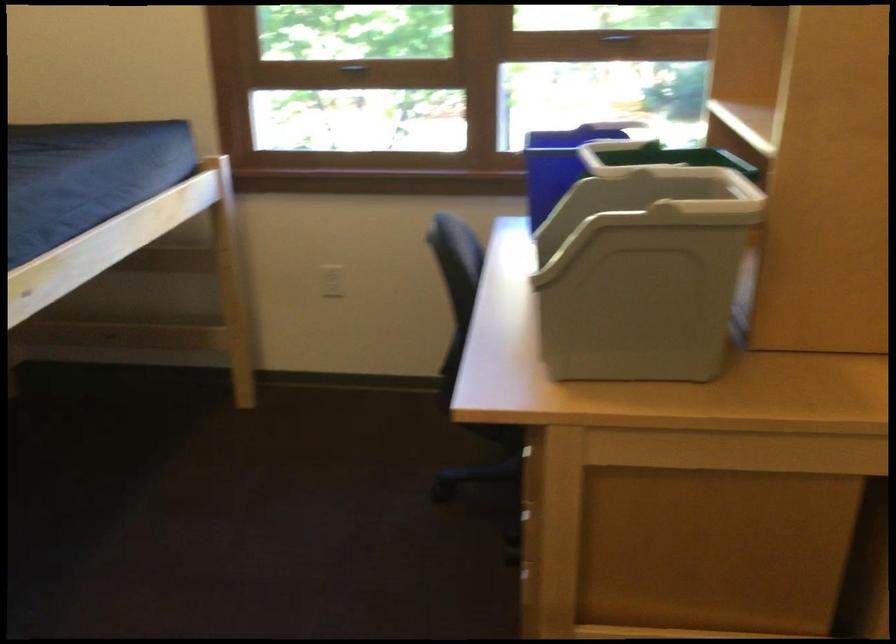
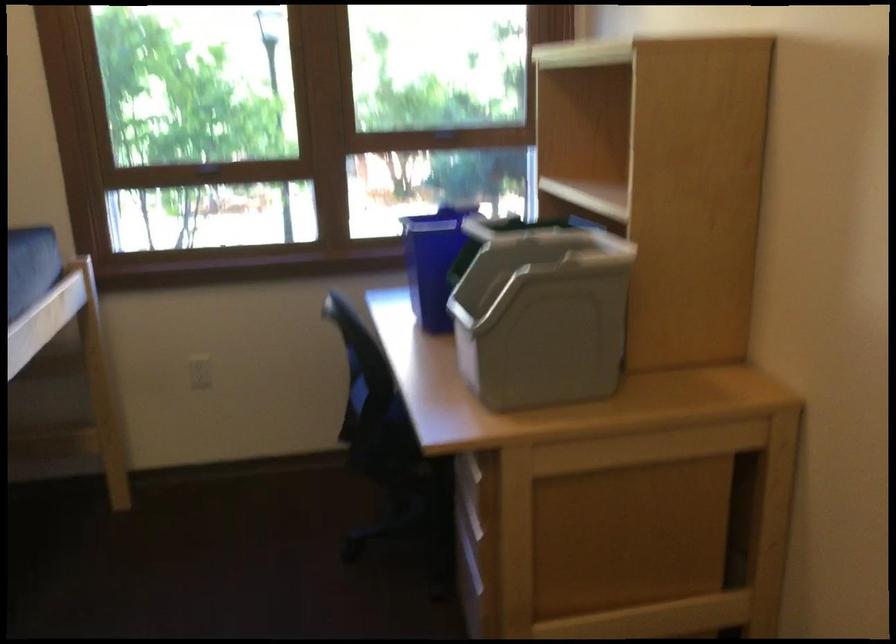
What movement of the cameraman would produce the second image?

The movement direction of the cameraman is left, backward.